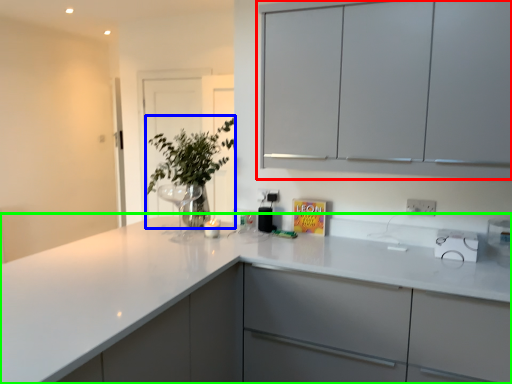
Question: Based on their relative distances, which object is farther from cabinetry (highlighted by a red box)? Choose from plant (highlighted by a blue box) and countertop (highlighted by a green box).

Choices:
 (A) plant
 (B) countertop

Answer: (A)